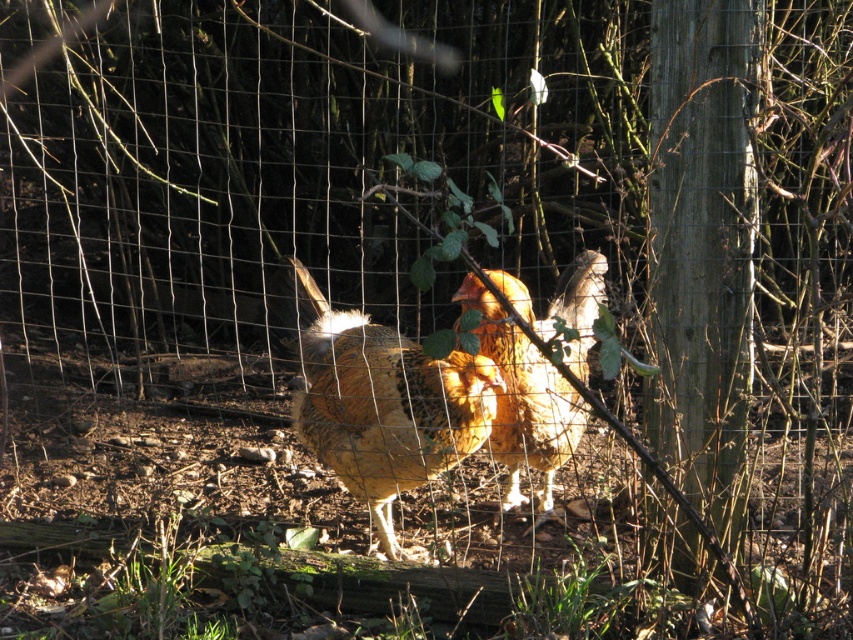
You are a farmer checking the chickens in the fenced area. You see the golden speckled chicken at center and the golden feathered chicken at center. Which chicken is located to the left of the other?

The golden speckled chicken at center is positioned on the left side of golden feathered chicken at center.

You are standing at the point with coordinates (386,404) in the image. What animal do you see there?

The golden speckled chicken at center is located at point (386,404).